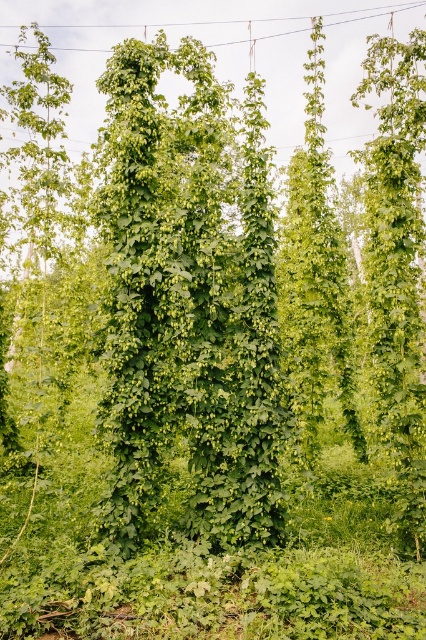
You are standing at the point closest to the hop field in the image. Which of the two points, point (169, 282) or point (74, 49), is closer to you?

Point (74, 49) is closer to you because it is behind point (169, 282), which is in front of it.

You are a farmer inspecting the hop field. You notice the green leafy plant at center and the metallic wire at upper center. Which object is located higher in the image?

The metallic wire at upper center is higher in the image than the green leafy plant at center.

You are a farmer checking the growth of the plants in the hop field. You notice the green leafy plant at center and the metallic wire at upper center. Which object is narrower in width?

The green leafy plant at center is narrower in width compared to the metallic wire at upper center.